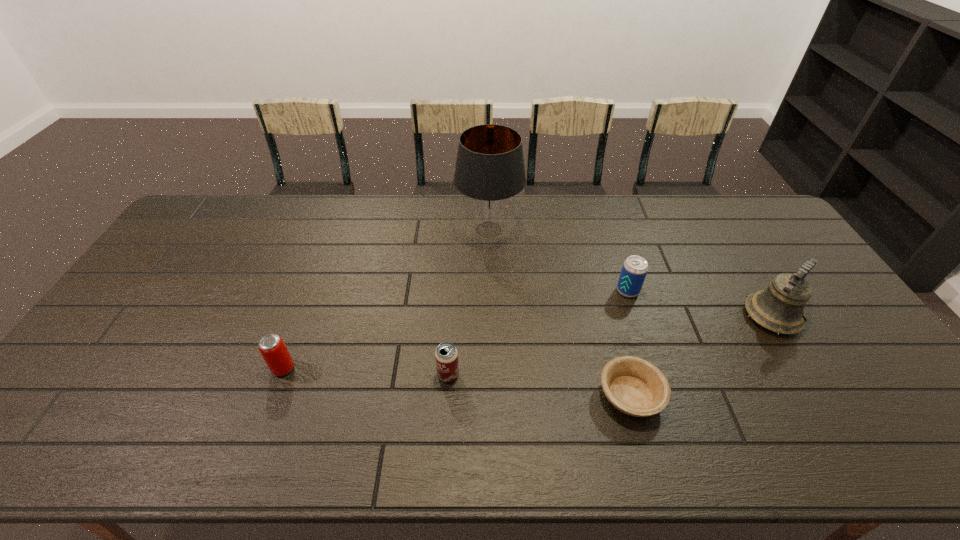
In the image, there is a desktop. Where is `free space at the right edge`? The image size is (960, 540). free space at the right edge is located at coordinates [876, 402].

Identify the location of vacant space at the far left corner of the desktop. (181, 230).

The image size is (960, 540). I want to click on free space between the leftmost beer can and the second beer can from left to right, so click(366, 372).

Where is `free space between the shortest object and the second beer can from left to right`? The image size is (960, 540). free space between the shortest object and the second beer can from left to right is located at coordinates (540, 385).

Where is `vacant space that is in between the shortest object and the second beer can from left to right`? This screenshot has height=540, width=960. vacant space that is in between the shortest object and the second beer can from left to right is located at coordinates (540, 385).

At what (x,y) coordinates should I click in order to perform the action: click on empty location between the fifth shortest object and the leftmost object. Please return your answer as a coordinate pair (x, y). Looking at the image, I should click on (528, 342).

What are the coordinates of `free space between the leftmost beer can and the lampshade` in the screenshot? It's located at (386, 299).

The width and height of the screenshot is (960, 540). Identify the location of vacant space that's between the leftmost object and the bowl. (457, 382).

Identify the location of free space between the rightmost beer can and the rightmost object. (700, 303).

The width and height of the screenshot is (960, 540). Identify the location of free space between the leftmost object and the farthest beer can. (455, 329).